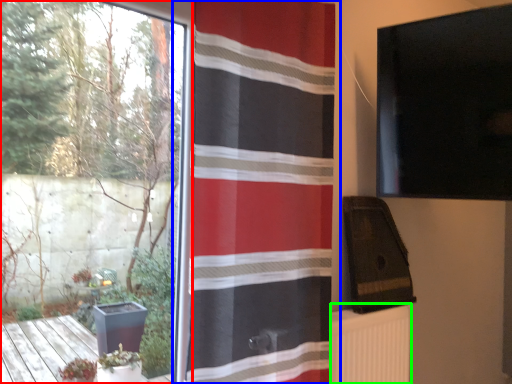
Question: Which object is the closest to the window (highlighted by a red box)? Choose among these: curtain (highlighted by a blue box) or radiator (highlighted by a green box).

Choices:
 (A) curtain
 (B) radiator

Answer: (A)